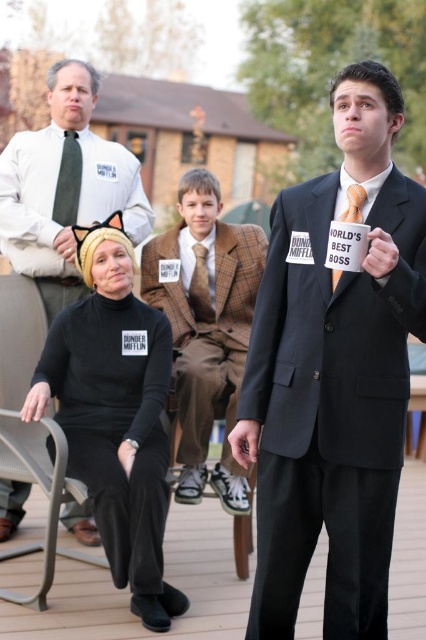
Which is below, brown checkered tie at center or orange silk tie at upper center?

brown checkered tie at center is lower down.

Find the location of a particular element. The height and width of the screenshot is (640, 426). brown checkered tie at center is located at coordinates (201, 288).

Is point (210, 304) farther from camera compared to point (345, 208)?

Yes.

Where is `brown checkered tie at center`? This screenshot has width=426, height=640. brown checkered tie at center is located at coordinates (201, 288).

Measure the distance between plaid wool suit at center and metallic gray chair at lower left.

A distance of 1.05 meters exists between plaid wool suit at center and metallic gray chair at lower left.

Is point (193, 435) positioned before point (17, 467)?

No, it is not.

I want to click on plaid wool suit at center, so click(x=206, y=326).

Based on the photo, is matte black suit at center smaller than black jersey at center?

Yes, matte black suit at center is smaller than black jersey at center.

Can you confirm if matte black suit at center is positioned to the right of black jersey at center?

Indeed, matte black suit at center is positioned on the right side of black jersey at center.

What do you see at coordinates (333, 374) in the screenshot? The height and width of the screenshot is (640, 426). I see `matte black suit at center` at bounding box center [333, 374].

Find the location of a particular element. The height and width of the screenshot is (640, 426). matte black suit at center is located at coordinates (333, 374).